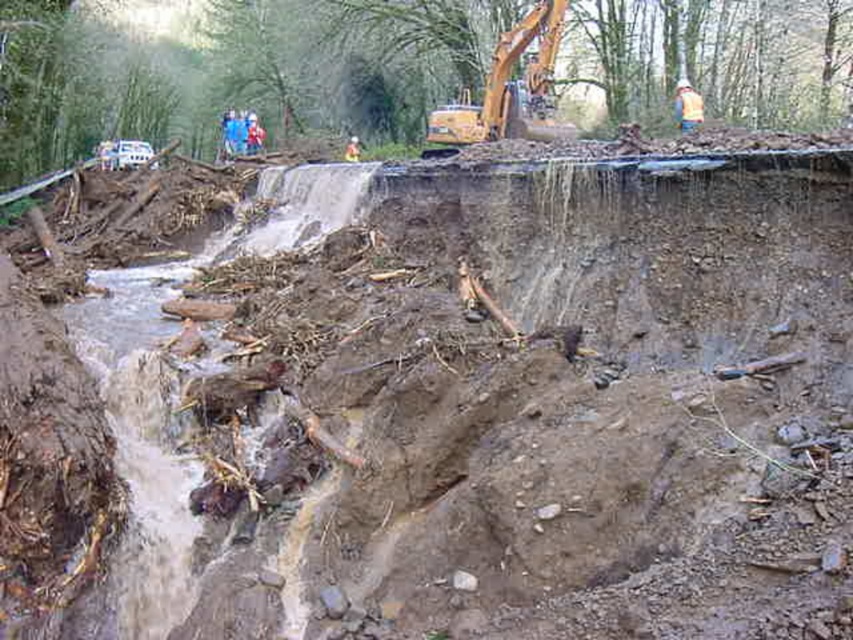
You are a safety inspector assessing the construction site. You notice the yellow metallic excavator at upper center and the yellow reflective vest at upper center. Which object is positioned higher in the image?

The yellow metallic excavator at upper center is taller than the yellow reflective vest at upper center, so the excavator is positioned higher in the image.

You are a surveyor analyzing the erosion site. You have two points marked on your map at coordinates point (448,141) and point (682,120). Which point is closer to the camera in the image?

Point (448,141) is closer to the camera than point (682,120).